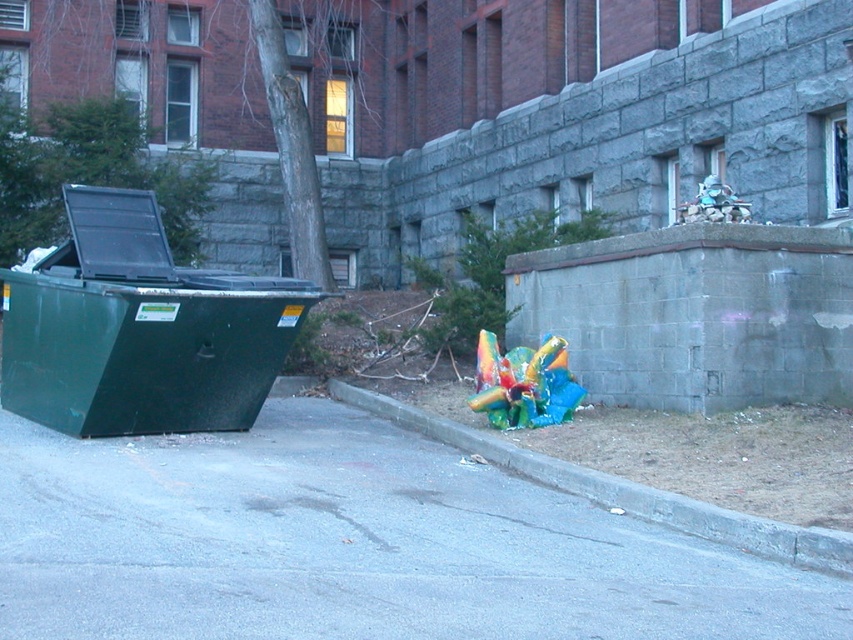
Question: Which point is closer to the camera?

Choices:
 (A) gray concrete curb at lower right
 (B) green matte recycling bin at left
 (C) gray asphalt pavement at lower center

Answer: (C)

Question: Where is green matte recycling bin at left located in relation to gray concrete curb at lower right in the image?

Choices:
 (A) left
 (B) right

Answer: (A)

Question: Which point is farther from the camera taking this photo?

Choices:
 (A) (128, 355)
 (B) (256, 429)

Answer: (B)

Question: Among these objects, which one is nearest to the camera?

Choices:
 (A) gray asphalt pavement at lower center
 (B) gray concrete curb at lower right
 (C) green matte recycling bin at left

Answer: (A)

Question: Is gray asphalt pavement at lower center below green matte recycling bin at left?

Choices:
 (A) no
 (B) yes

Answer: (B)

Question: Can you confirm if gray asphalt pavement at lower center is smaller than gray concrete curb at lower right?

Choices:
 (A) no
 (B) yes

Answer: (B)